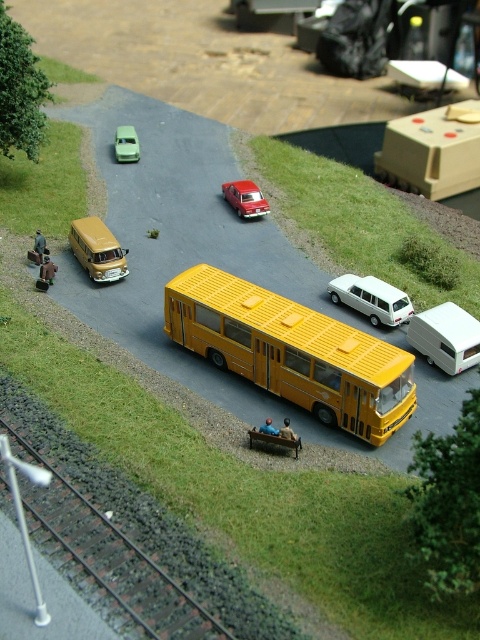
You are a delivery person trying to reach the shiny red car at center. There is a metallic gold van at left blocking your path. Can you go around it on the right side?

The metallic gold van at left is positioned under the shiny red car at center, which means the van is directly below the car. Since the van is blocking the path to the car, you can go around it on the right side to reach the shiny red car at center.

You are a toy car collector who wants to display the yellow matte bus at center and the green matte car at upper left on a shelf. If the shelf has a height limit of 10 cm, can both items be displayed without exceeding the height limit?

The yellow matte bus at center is taller than the green matte car at upper left. However, since the exact heights are not provided, it is uncertain if the bus alone or both together exceed the 10 cm limit. Additional measurements are needed.